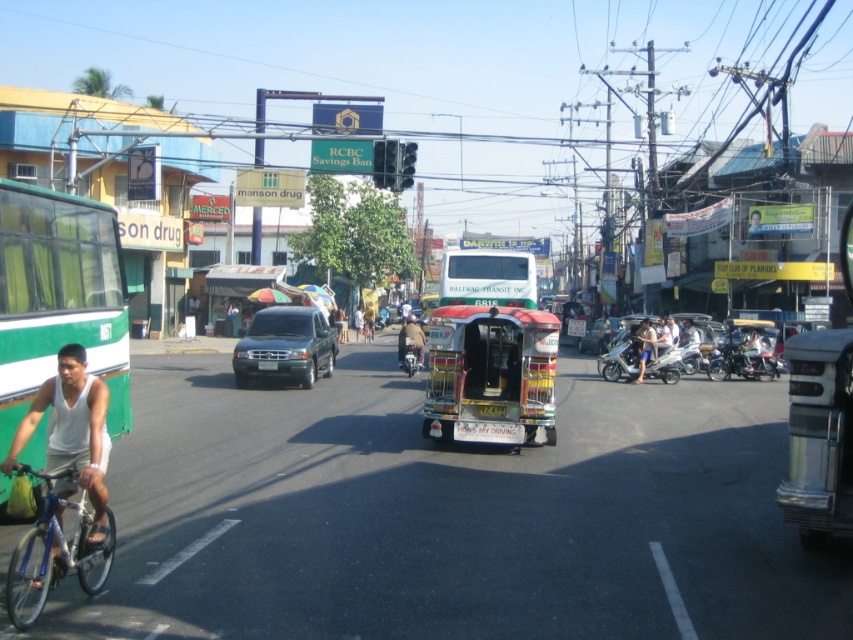
Is metallic silver motorcycle at center-right positioned in front of brown leather jacket at center?

That is False.

Does metallic silver motorcycle at center-right have a greater width compared to brown leather jacket at center?

In fact, metallic silver motorcycle at center-right might be narrower than brown leather jacket at center.

Find the location of `metallic silver motorcycle at center-right`. metallic silver motorcycle at center-right is located at coordinates (741, 364).

Is white fabric shirt at lower left smaller than blue metallic bicycle at lower left?

Incorrect, white fabric shirt at lower left is not smaller in size than blue metallic bicycle at lower left.

Who is shorter, white fabric shirt at lower left or blue metallic bicycle at lower left?

blue metallic bicycle at lower left is shorter.

What are the coordinates of `white fabric shirt at lower left` in the screenshot? It's located at (73, 433).

Describe the element at coordinates (285, 346) in the screenshot. The width and height of the screenshot is (853, 640). I see `metallic green van at center` at that location.

Does metallic green van at center have a lesser width compared to brown leather jacket at center?

No.

Does point (282, 317) come in front of point (407, 336)?

That is True.

Image resolution: width=853 pixels, height=640 pixels. In order to click on metallic green van at center in this screenshot , I will do `click(285, 346)`.